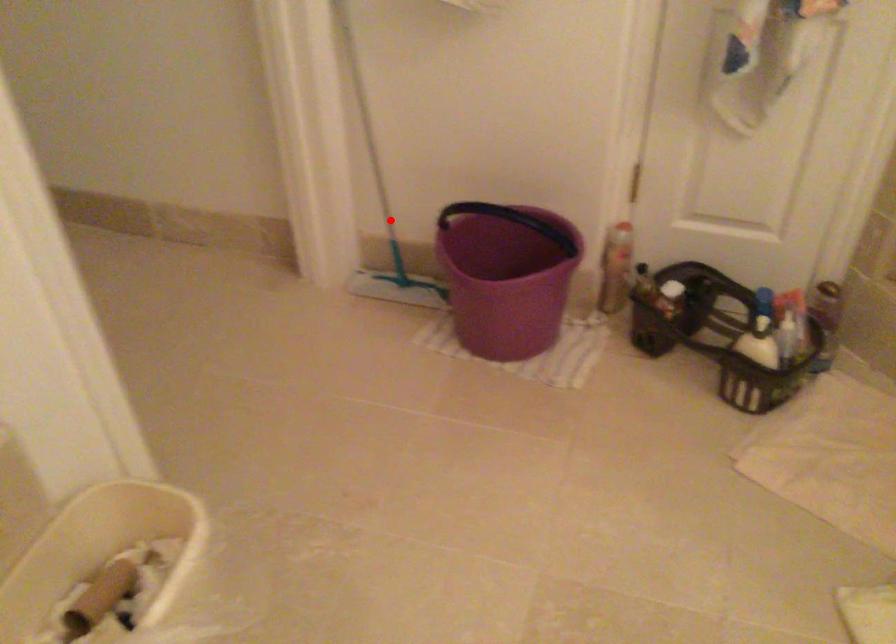
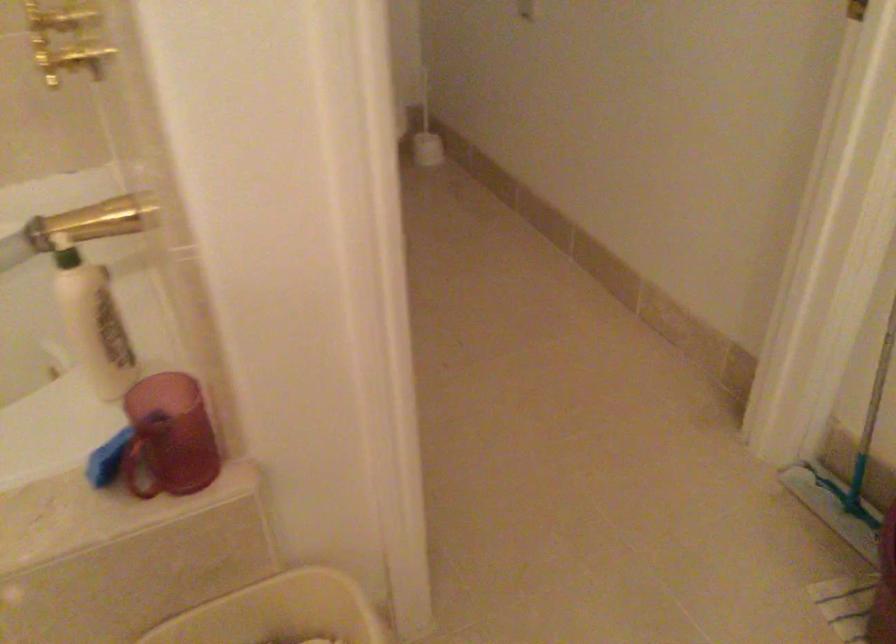
Question: I am providing you with two images of the same scene from different viewpoints. A red point is marked on the first image. At the location where the point appears in image 1, is it still visible in image 2?

Choices:
 (A) Yes
 (B) No

Answer: (A)